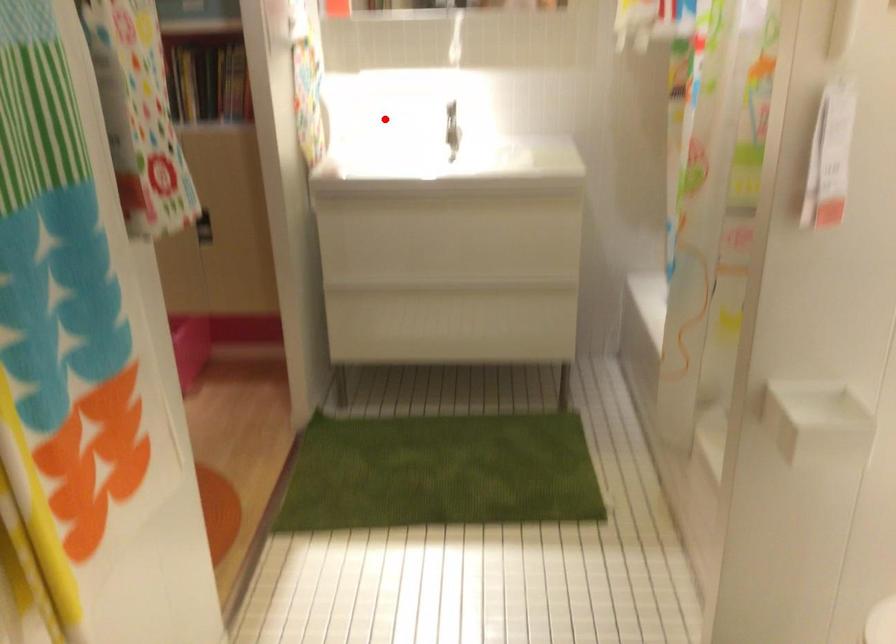
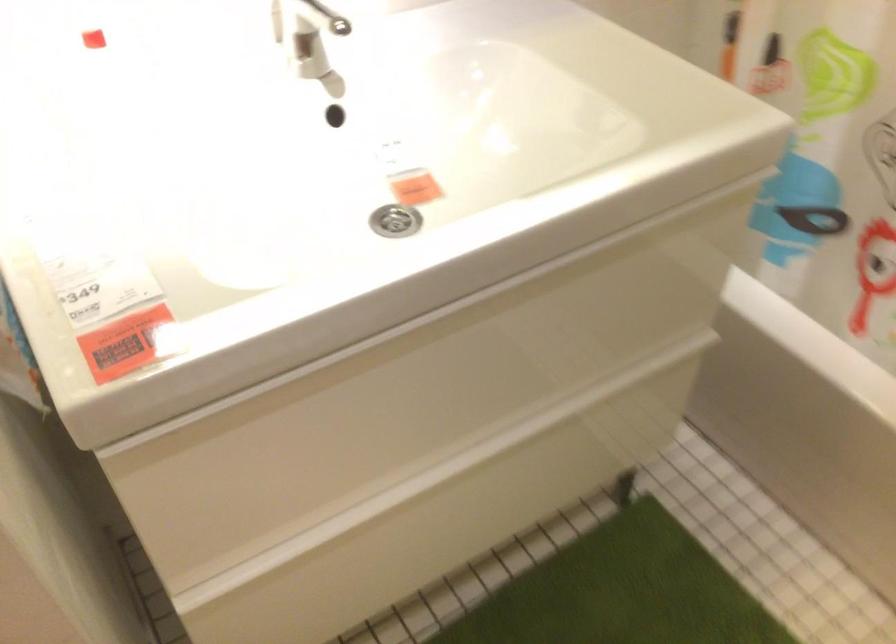
Locate, in the second image, the point that corresponds to the highlighted location in the first image.

(92, 39)